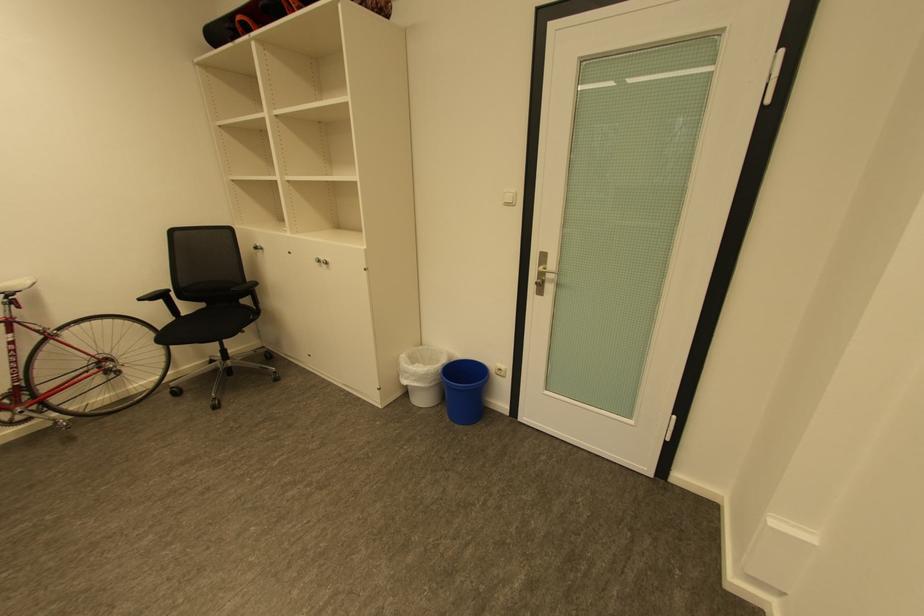
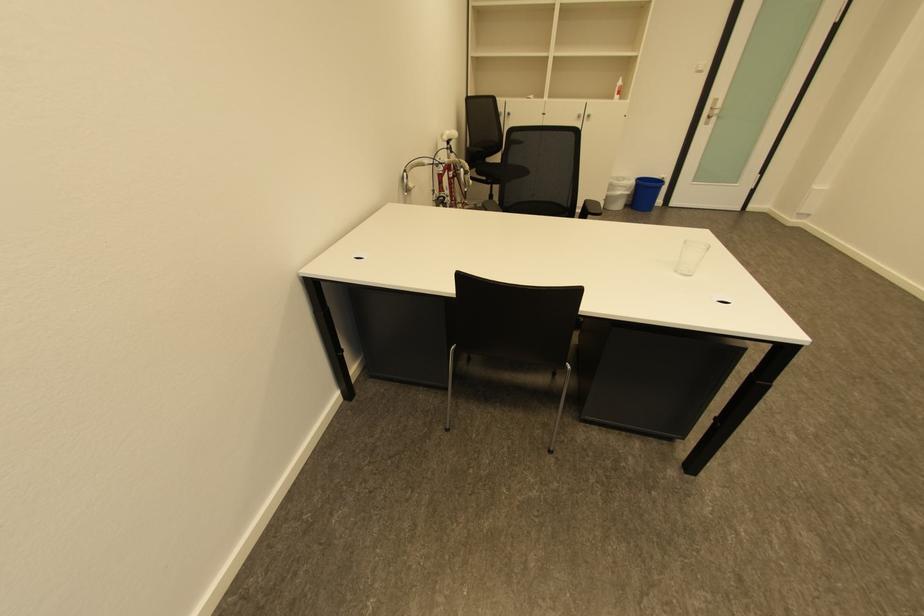
The point at (x=414, y=373) is marked in the first image. Where is the corresponding point in the second image?

(626, 188)